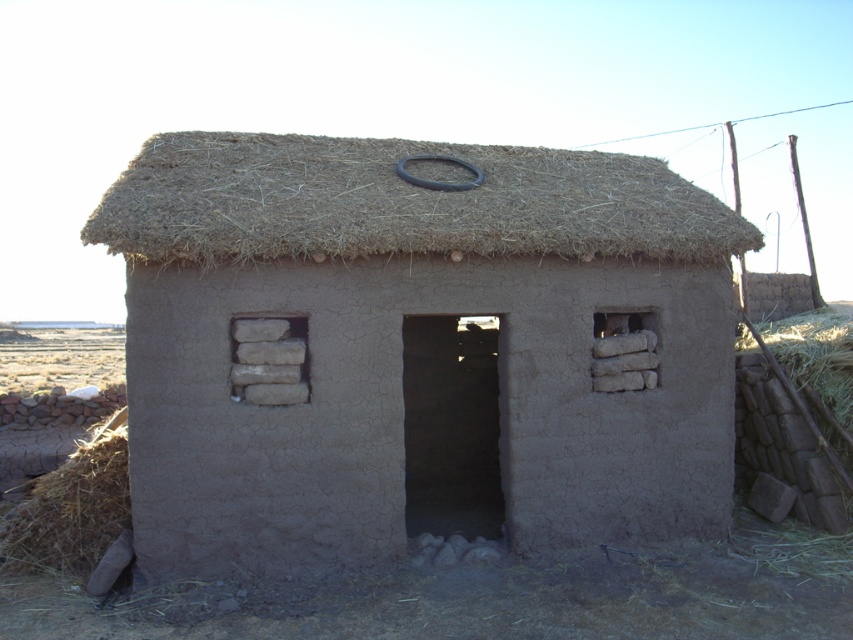
Does brown mud hut at center have a larger size compared to brown thatch at center?

No.

Is brown mud hut at center positioned behind brown thatch at center?

Yes, brown mud hut at center is behind brown thatch at center.

Measure the distance between brown mud hut at center and camera.

brown mud hut at center and camera are 22.14 feet apart from each other.

Image resolution: width=853 pixels, height=640 pixels. Identify the location of brown mud hut at center. (416, 348).

Does brown thatch at center have a greater width compared to brown straw at lower left?

Indeed, brown thatch at center has a greater width compared to brown straw at lower left.

Between point (660, 200) and point (119, 515), which one is positioned behind?

The point (660, 200) is behind.

Is point (531, 205) positioned behind point (70, 499)?

Yes, point (531, 205) is behind point (70, 499).

Where is `brown thatch at center`? The width and height of the screenshot is (853, 640). brown thatch at center is located at coordinates [402, 202].

Does brown mud hut at center have a larger size compared to brown straw at lower left?

No.

The width and height of the screenshot is (853, 640). I want to click on brown mud hut at center, so click(x=416, y=348).

Who is more forward, (x=671, y=336) or (x=106, y=464)?

Point (x=106, y=464) is more forward.

At what (x,y) coordinates should I click in order to perform the action: click on brown mud hut at center. Please return your answer as a coordinate pair (x, y). The height and width of the screenshot is (640, 853). Looking at the image, I should click on (416, 348).